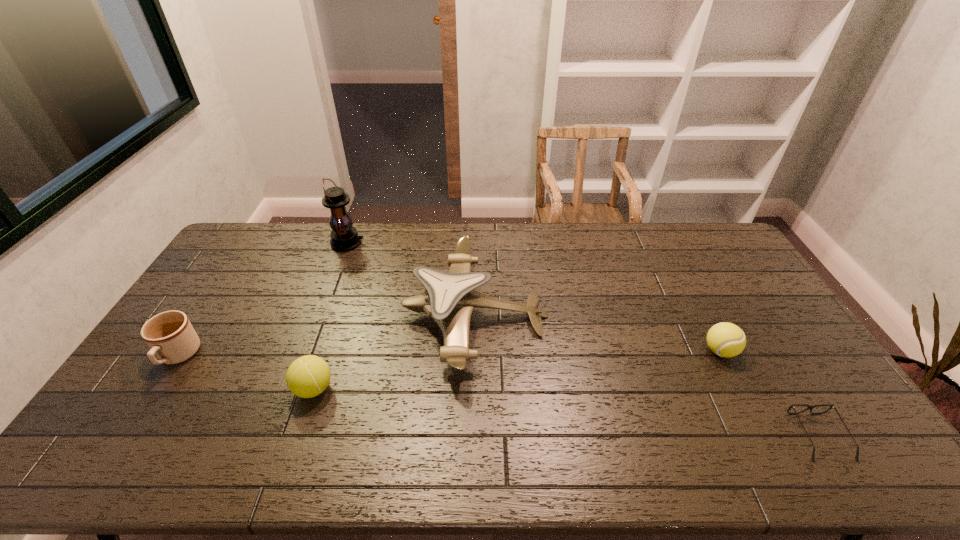
In the image, there is a desktop. Where is `vacant region at the far edge`? The image size is (960, 540). vacant region at the far edge is located at coordinates (658, 240).

In the image, there is a desktop. At what (x,y) coordinates should I click in order to perform the action: click on vacant region at the near edge. Please return your answer as a coordinate pair (x, y). The image size is (960, 540). Looking at the image, I should click on (403, 469).

Find the location of a particular element. free space at the left edge of the desktop is located at coordinates (221, 302).

Locate an element on the screen. Image resolution: width=960 pixels, height=540 pixels. free region at the right edge is located at coordinates (831, 401).

The height and width of the screenshot is (540, 960). In order to click on free space between the fourth object from left to right and the nearest object in this screenshot , I will do `click(647, 376)`.

Find the location of a particular element. free space between the rightmost object and the left tennis ball is located at coordinates (566, 413).

The height and width of the screenshot is (540, 960). Find the location of `free space between the farthest object and the leftmost object`. free space between the farthest object and the leftmost object is located at coordinates (263, 300).

Where is `free space that is in between the nearer tennis ball and the drone`? free space that is in between the nearer tennis ball and the drone is located at coordinates (395, 352).

Image resolution: width=960 pixels, height=540 pixels. I want to click on free area in between the left tennis ball and the spectacles, so click(x=566, y=413).

Find the location of a particular element. free space between the mug and the left tennis ball is located at coordinates (246, 373).